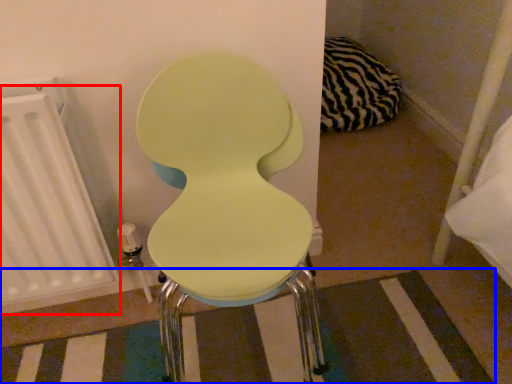
Question: Which object appears farthest to the camera in this image, radiator (highlighted by a red box) or strip (highlighted by a blue box)?

Choices:
 (A) radiator
 (B) strip

Answer: (B)